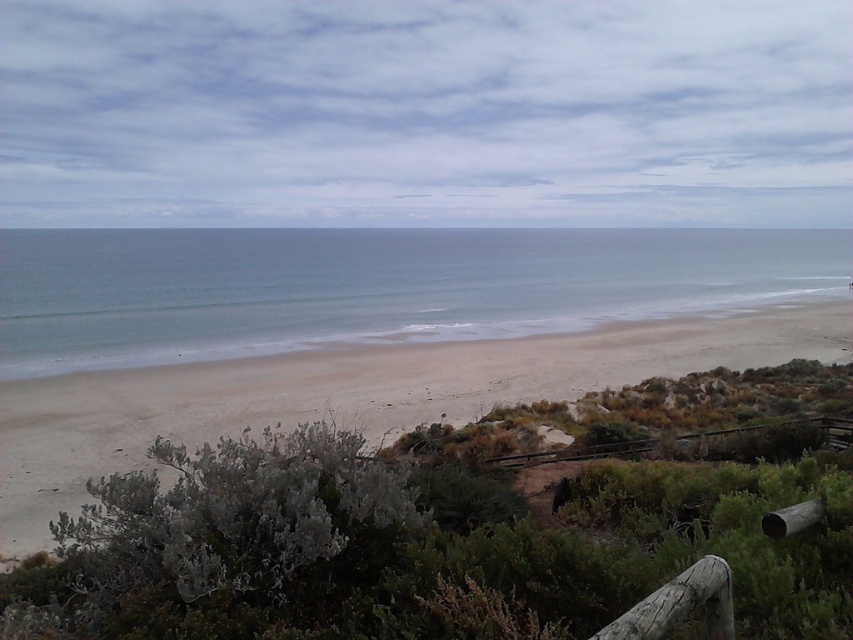
Question: Is blue smooth water at center above light brown sand at center?

Choices:
 (A) no
 (B) yes

Answer: (B)

Question: Is blue smooth water at center to the left of light brown sand at center from the viewer's perspective?

Choices:
 (A) yes
 (B) no

Answer: (A)

Question: Which object is closer to the camera taking this photo?

Choices:
 (A) blue smooth water at center
 (B) light brown sand at center

Answer: (B)

Question: Does blue smooth water at center have a larger size compared to light brown sand at center?

Choices:
 (A) no
 (B) yes

Answer: (B)